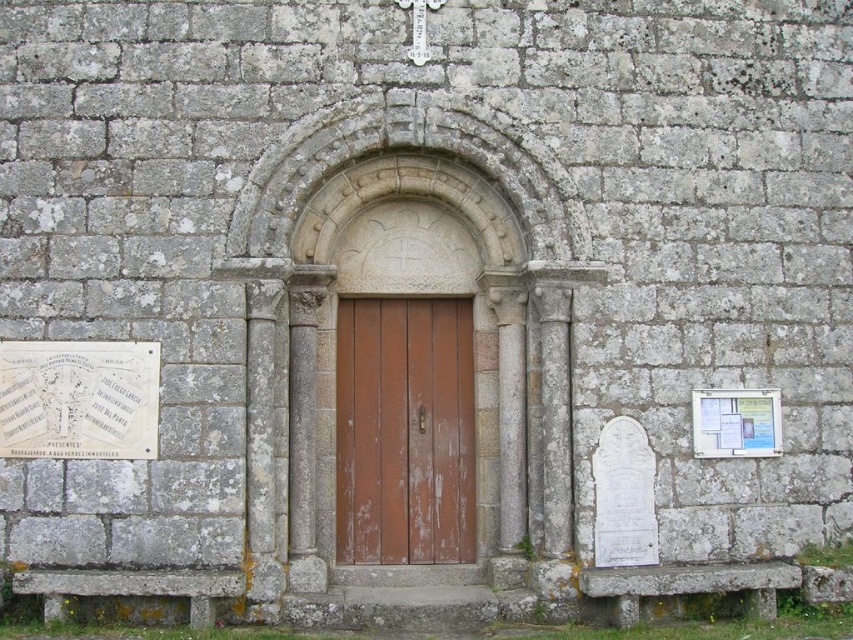
Question: Does rusty wood door at center appear on the left side of white paper plaque at lower left?

Choices:
 (A) yes
 (B) no

Answer: (B)

Question: Estimate the real-world distances between objects in this image. Which object is closer to the rusty wood door at center?

Choices:
 (A) white paper at center
 (B) white paper plaque at lower left

Answer: (B)

Question: Among these points, which one is farthest from the camera?

Choices:
 (A) (337, 458)
 (B) (772, 428)

Answer: (A)

Question: Which point appears farthest from the camera in this image?

Choices:
 (A) (90, 429)
 (B) (413, 554)

Answer: (B)

Question: Can you confirm if rusty wood door at center is smaller than white paper at center?

Choices:
 (A) no
 (B) yes

Answer: (A)

Question: Can you confirm if rusty wood door at center is bigger than white paper plaque at lower left?

Choices:
 (A) yes
 (B) no

Answer: (A)